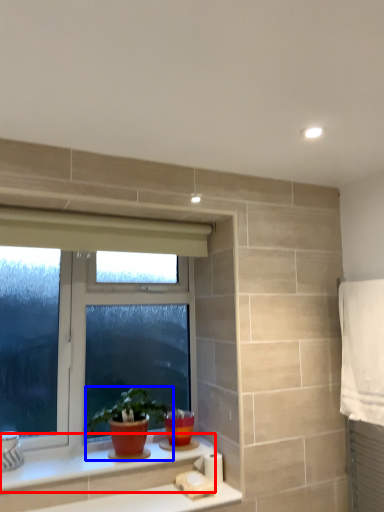
Question: Which of the following is the farthest to the observer, counter top (highlighted by a red box) or houseplant (highlighted by a blue box)?

Choices:
 (A) counter top
 (B) houseplant

Answer: (B)